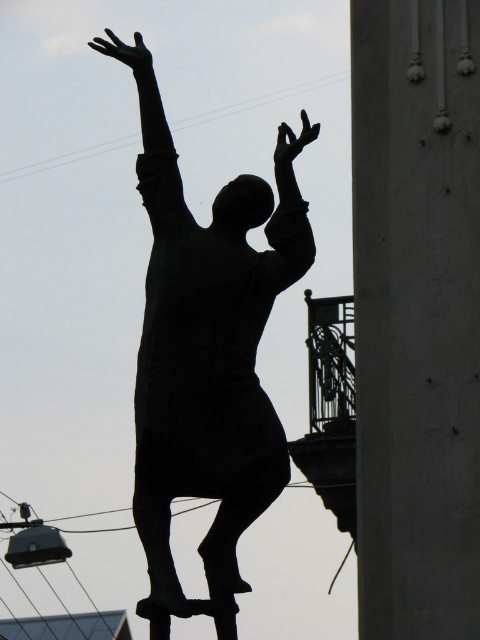
Is point (360, 561) positioned before point (173, 211)?

No.

Is point (389, 44) positioned after point (252, 308)?

That is True.

Identify the location of smooth concrete pillar at right. This screenshot has height=640, width=480. (417, 316).

Does smooth concrete pillar at right have a greater width compared to black matte arm at upper center?

Correct, the width of smooth concrete pillar at right exceeds that of black matte arm at upper center.

Is smooth concrete pillar at right taller than black matte arm at upper center?

Indeed, smooth concrete pillar at right has a greater height compared to black matte arm at upper center.

Who is more forward, (463, 429) or (164, 122)?

Point (463, 429) is in front.

The height and width of the screenshot is (640, 480). What are the coordinates of `smooth concrete pillar at right` in the screenshot? It's located at (417, 316).

Does smooth concrete pillar at right appear over black matte arm at center?

Actually, smooth concrete pillar at right is below black matte arm at center.

Between point (455, 152) and point (277, 227), which one is positioned in front?

Point (277, 227)

Locate an element on the screen. Image resolution: width=480 pixels, height=640 pixels. smooth concrete pillar at right is located at coordinates (417, 316).